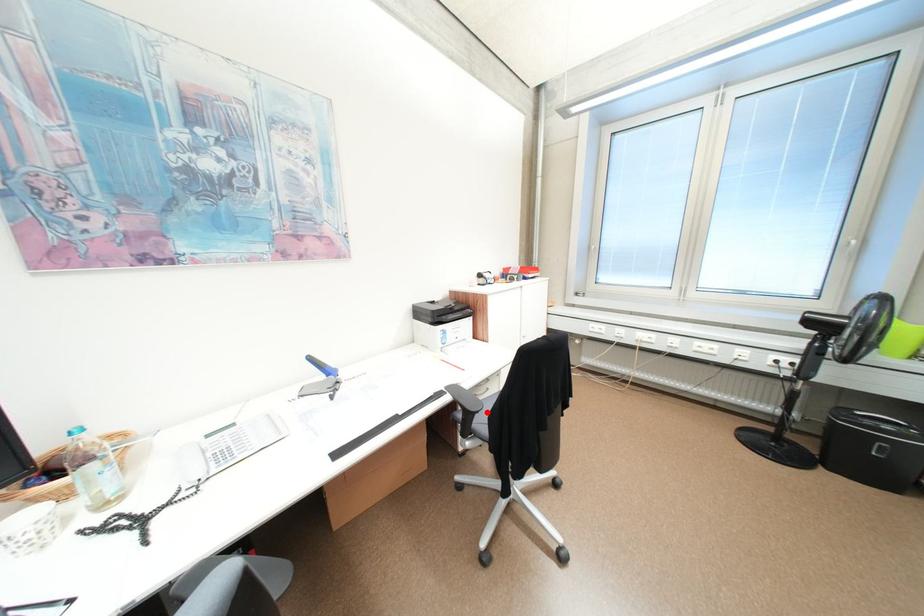
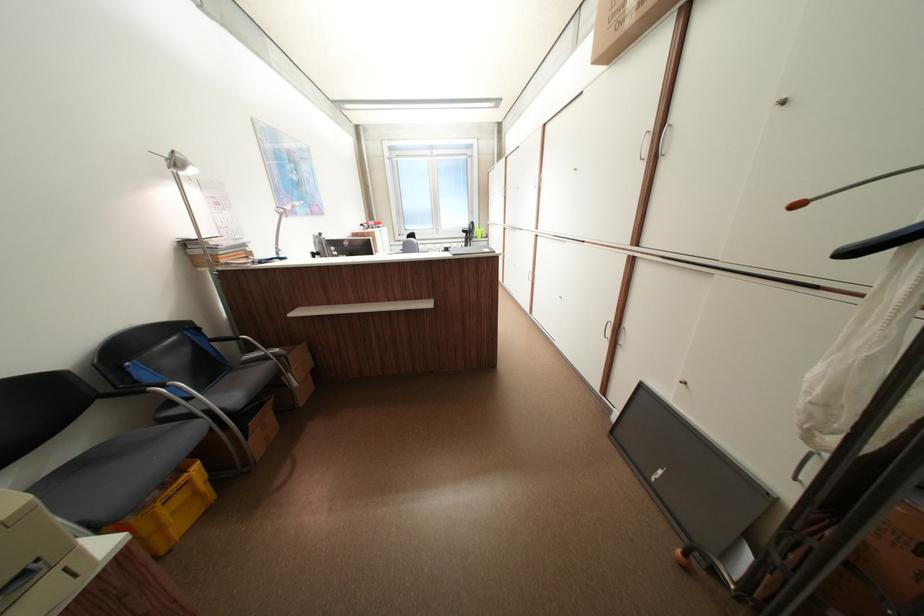
Question: A red point is marked in image1. In image2, is the corresponding 3D point closer to the camera or farther? Reply with the corresponding letter.

Choices:
 (A) The corresponding 3D point is closer.
 (B) The corresponding 3D point is farther.

Answer: (B)